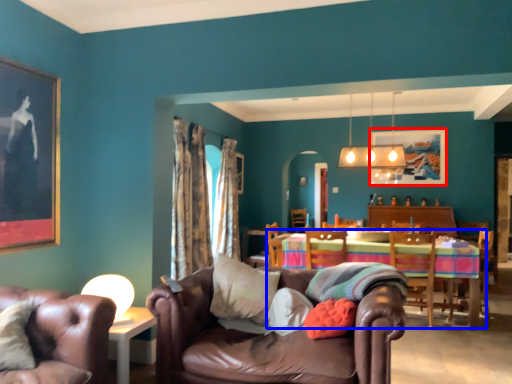
Question: Which point is further to the camera, picture frame (highlighted by a red box) or kitchen & dining room table (highlighted by a blue box)?

Choices:
 (A) picture frame
 (B) kitchen & dining room table

Answer: (A)